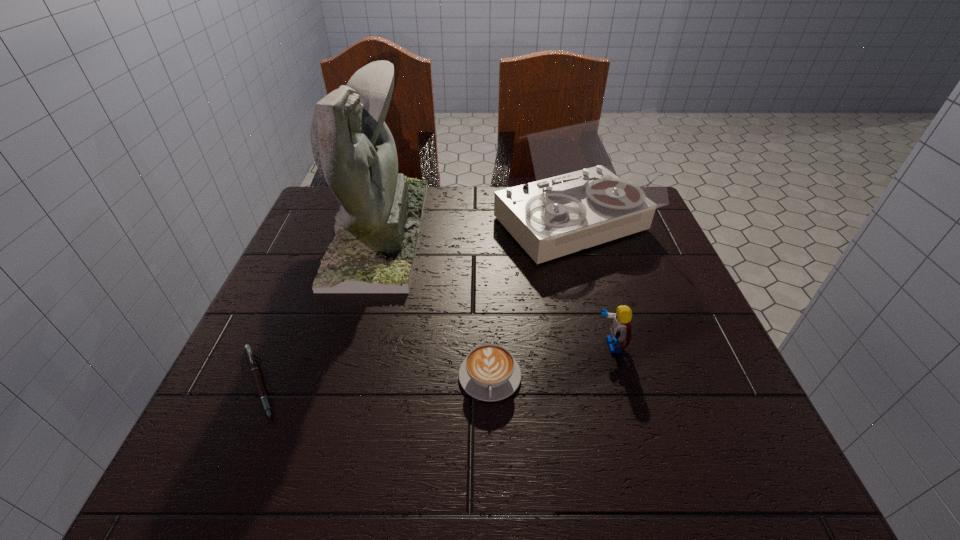
The width and height of the screenshot is (960, 540). What are the coordinates of `free space between the record player and the pen` in the screenshot? It's located at click(416, 305).

Locate an element on the screen. The image size is (960, 540). vacant point located between the tallest object and the cappuccino is located at coordinates (435, 304).

Identify the location of free spot between the sculpture and the third shortest object. This screenshot has height=540, width=960. (495, 288).

Where is `blank region between the pen and the third shortest object`? Image resolution: width=960 pixels, height=540 pixels. blank region between the pen and the third shortest object is located at coordinates (435, 363).

Choose which object is the fourth nearest neighbor to the third shortest object. Please provide its 2D coordinates. Your answer should be formatted as a tuple, i.e. [(x, y)], where the tuple contains the x and y coordinates of a point satisfying the conditions above.

[(250, 356)]

Identify the location of the second closest object relative to the record player. (377, 227).

Find the location of a particular element. blank area in the image that satisfies the following two spatial constraints: 1. on the side of the second shortest object with the handle; 2. at the nib of the pen is located at coordinates (490, 382).

Where is `free point that satisfies the following two spatial constraints: 1. on the side of the second shortest object with the handle; 2. at the nib of the pen`? Image resolution: width=960 pixels, height=540 pixels. free point that satisfies the following two spatial constraints: 1. on the side of the second shortest object with the handle; 2. at the nib of the pen is located at coordinates (490, 382).